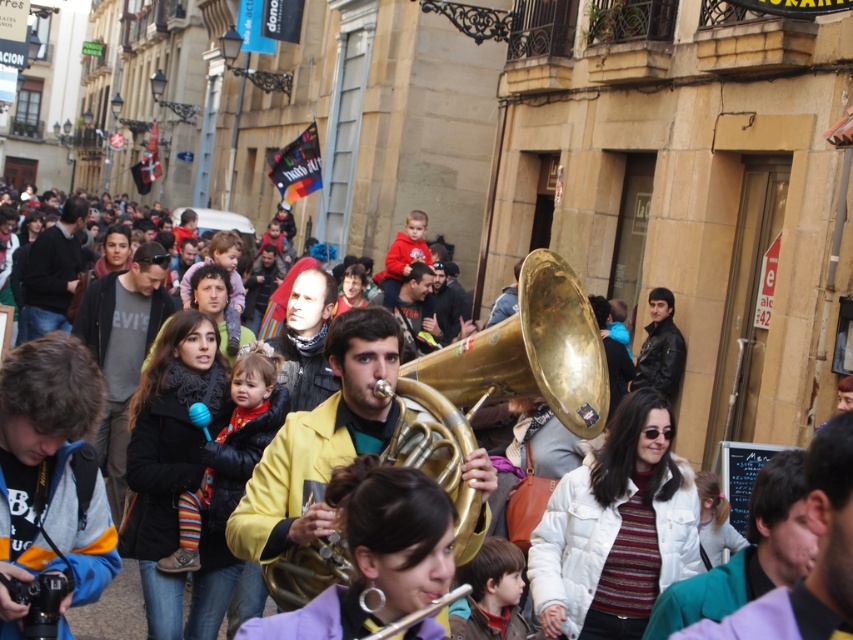
Does brown hair at center have a lesser height compared to gold brass tuba at center?

Yes, brown hair at center is shorter than gold brass tuba at center.

Can you confirm if brown hair at center is smaller than gold brass tuba at center?

Yes, brown hair at center is smaller than gold brass tuba at center.

This screenshot has width=853, height=640. What are the coordinates of `brown hair at center` in the screenshot? It's located at (491, 593).

At what (x,y) coordinates should I click in order to perform the action: click on brown hair at center. Please return your answer as a coordinate pair (x, y). The image size is (853, 640). Looking at the image, I should click on (491, 593).

Does gold brass trumpet at center appear over brown hair at center?

Yes, gold brass trumpet at center is above brown hair at center.

Describe the element at coordinates (505, 380) in the screenshot. The width and height of the screenshot is (853, 640). I see `gold brass trumpet at center` at that location.

Find the location of a particular element. gold brass trumpet at center is located at coordinates (505, 380).

Image resolution: width=853 pixels, height=640 pixels. What do you see at coordinates (505, 380) in the screenshot? I see `gold brass trumpet at center` at bounding box center [505, 380].

Which is behind, point (573, 330) or point (230, 387)?

The point (230, 387) is more distant.

Which is in front, point (412, 410) or point (219, 426)?

Point (412, 410) is in front.

At what (x,y) coordinates should I click in order to perform the action: click on gold brass trumpet at center. Please return your answer as a coordinate pair (x, y). Image resolution: width=853 pixels, height=640 pixels. Looking at the image, I should click on (505, 380).